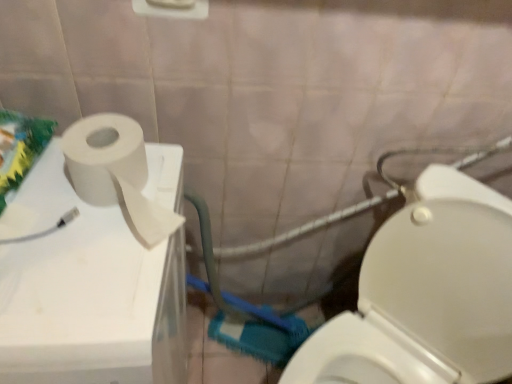
Question: In terms of width, does white matte toilet paper at upper left look wider or thinner when compared to white glossy toilet at lower right?

Choices:
 (A) wide
 (B) thin

Answer: (B)

Question: Would you say white matte toilet paper at upper left is inside or outside white glossy toilet at lower right?

Choices:
 (A) inside
 (B) outside

Answer: (B)

Question: Based on their relative distances, which object is nearer to the white matte toilet paper at left?

Choices:
 (A) white glossy toilet at lower right
 (B) white matte toilet paper at upper left

Answer: (B)

Question: Based on their relative distances, which object is nearer to the white matte toilet paper at left?

Choices:
 (A) white glossy toilet at lower right
 (B) white matte toilet paper at upper left

Answer: (B)